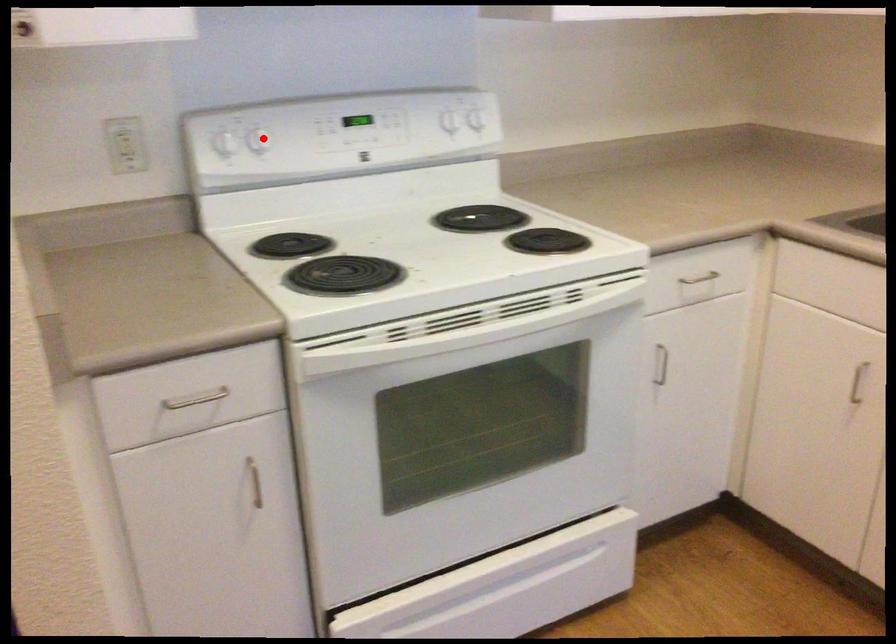
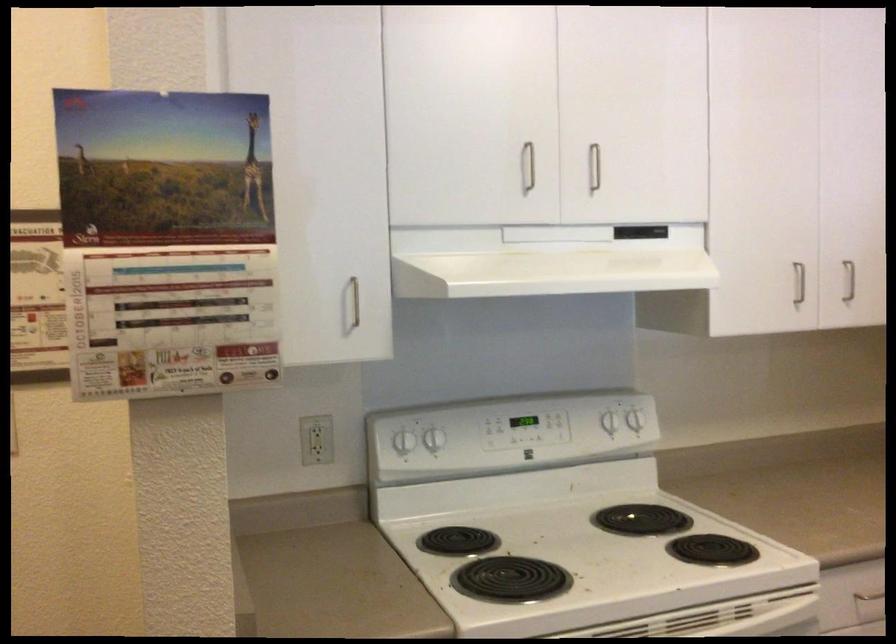
The point at the highlighted location is marked in the first image. Where is the corresponding point in the second image?

(435, 439)